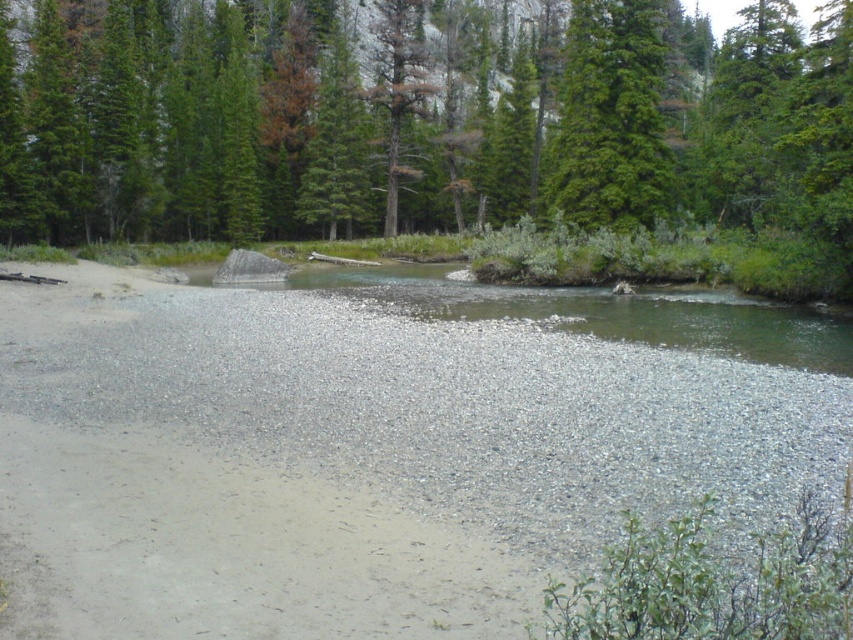
Question: Which of the following is the closest to the observer?

Choices:
 (A) (618, 220)
 (B) (103, 476)
 (C) (405, 284)
 (D) (715, 168)

Answer: (B)

Question: Is green leafy forest at upper center bigger than clear water at center?

Choices:
 (A) no
 (B) yes

Answer: (B)

Question: Does green leafy forest at upper center have a smaller size compared to green textured tree at upper right?

Choices:
 (A) yes
 (B) no

Answer: (B)

Question: Which object is positioned closest to the gray gravel at center?

Choices:
 (A) green leafy forest at upper center
 (B) green textured tree at upper right
 (C) clear water at center

Answer: (C)

Question: Based on their relative distances, which object is farther from the clear water at center?

Choices:
 (A) gray gravel at center
 (B) green leafy forest at upper center
 (C) green textured tree at upper right

Answer: (B)

Question: Does green leafy forest at upper center have a larger size compared to green textured tree at upper right?

Choices:
 (A) no
 (B) yes

Answer: (B)